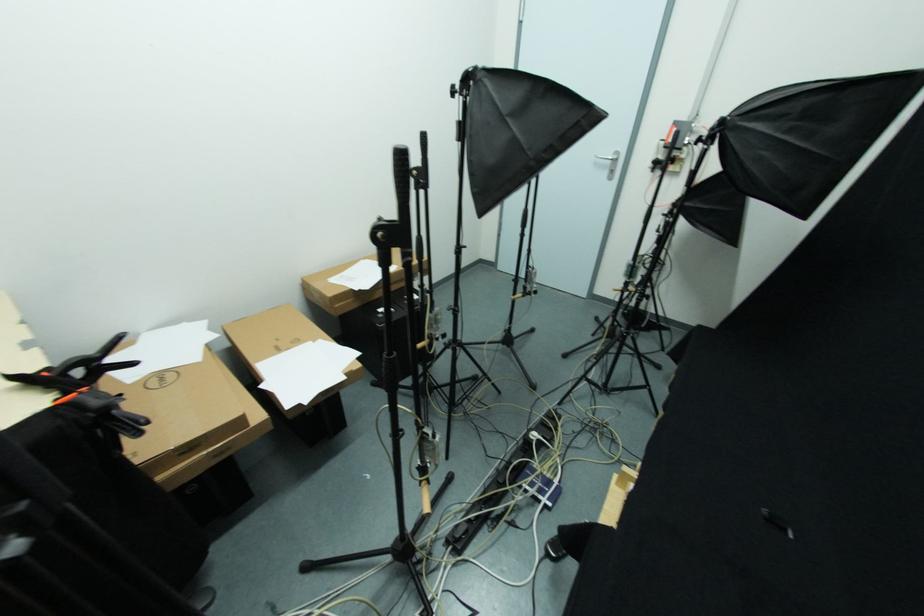
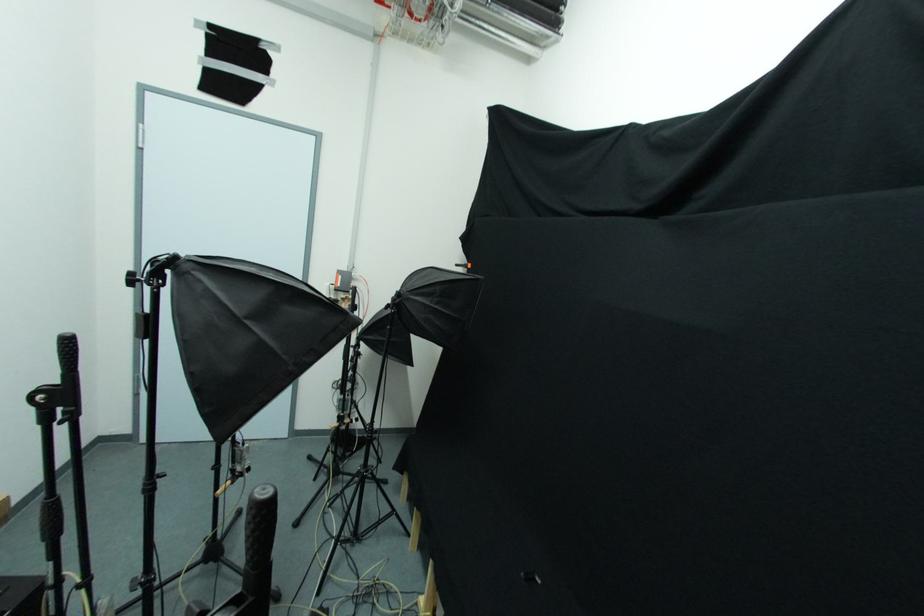
Question: The camera is either moving clockwise (left) or counter-clockwise (right) around the object. The first image is from the beginning of the video and the second image is from the end. Is the camera moving left or right when shooting the video?

Choices:
 (A) Left
 (B) Right

Answer: (A)